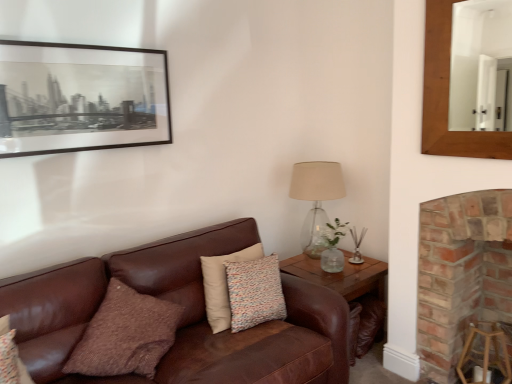
Question: Can you confirm if translucent glass table lamp at right is taller than wooden mirror at upper right?

Choices:
 (A) yes
 (B) no

Answer: (B)

Question: Considering the relative positions of translucent glass table lamp at right and wooden mirror at upper right in the image provided, is translucent glass table lamp at right to the right of wooden mirror at upper right from the viewer's perspective?

Choices:
 (A) no
 (B) yes

Answer: (A)

Question: Is translucent glass table lamp at right oriented away from wooden mirror at upper right?

Choices:
 (A) no
 (B) yes

Answer: (A)

Question: Considering the relative positions of translucent glass table lamp at right and wooden mirror at upper right in the image provided, is translucent glass table lamp at right to the left of wooden mirror at upper right from the viewer's perspective?

Choices:
 (A) yes
 (B) no

Answer: (A)

Question: Can you see translucent glass table lamp at right touching wooden mirror at upper right?

Choices:
 (A) yes
 (B) no

Answer: (B)

Question: Is brick fireplace at right taller or shorter than brown leather couch at center?

Choices:
 (A) tall
 (B) short

Answer: (A)

Question: In the image, is brick fireplace at right on the left side or the right side of brown leather couch at center?

Choices:
 (A) left
 (B) right

Answer: (B)

Question: Is brick fireplace at right inside the boundaries of brown leather couch at center, or outside?

Choices:
 (A) inside
 (B) outside

Answer: (B)

Question: From the image's perspective, relative to brown leather couch at center, is brick fireplace at right above or below?

Choices:
 (A) above
 (B) below

Answer: (A)

Question: Considering the positions of point (452, 316) and point (108, 311), is point (452, 316) closer or farther from the camera than point (108, 311)?

Choices:
 (A) closer
 (B) farther

Answer: (B)

Question: In the image, is brick fireplace at right positioned in front of or behind brown textured pillow at center?

Choices:
 (A) front
 (B) behind

Answer: (B)

Question: From a real-world perspective, relative to brown textured pillow at center, is brick fireplace at right vertically above or below?

Choices:
 (A) below
 (B) above

Answer: (B)

Question: From the image's perspective, is brick fireplace at right above or below brown textured pillow at center?

Choices:
 (A) above
 (B) below

Answer: (A)

Question: From a real-world perspective, relative to brown leather couch at center, is wooden stool at lower right vertically above or below?

Choices:
 (A) below
 (B) above

Answer: (A)

Question: Considering the positions of wooden stool at lower right and brown leather couch at center in the image, is wooden stool at lower right wider or thinner than brown leather couch at center?

Choices:
 (A) wide
 (B) thin

Answer: (B)